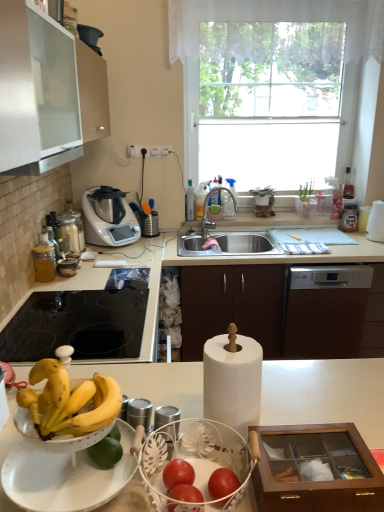
The width and height of the screenshot is (384, 512). What are the coordinates of `empty space that is ontop of black glass cooktop at lower left (from a real-world perspective)` in the screenshot? It's located at (85, 325).